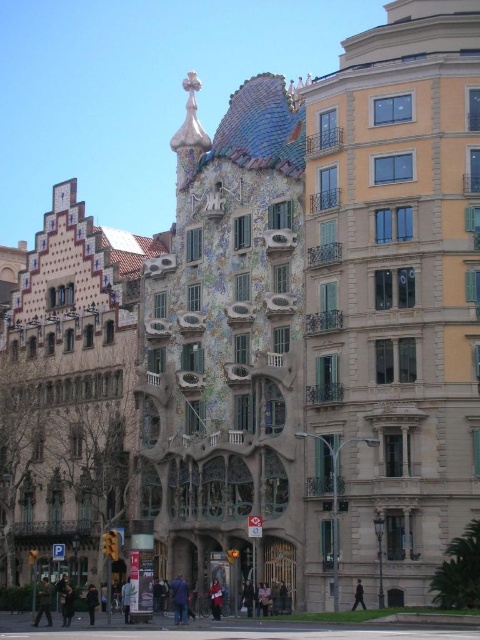
In the scene shown: You are a fashion designer observing the scene and want to place a mannequin wearing the dark brown leather coat at lower center and dark blue jeans at center. Which clothing item is shorter in height?

The dark brown leather coat at lower center has a lesser height compared to dark blue jeans at center, so the dark brown leather coat at lower center is shorter in height.